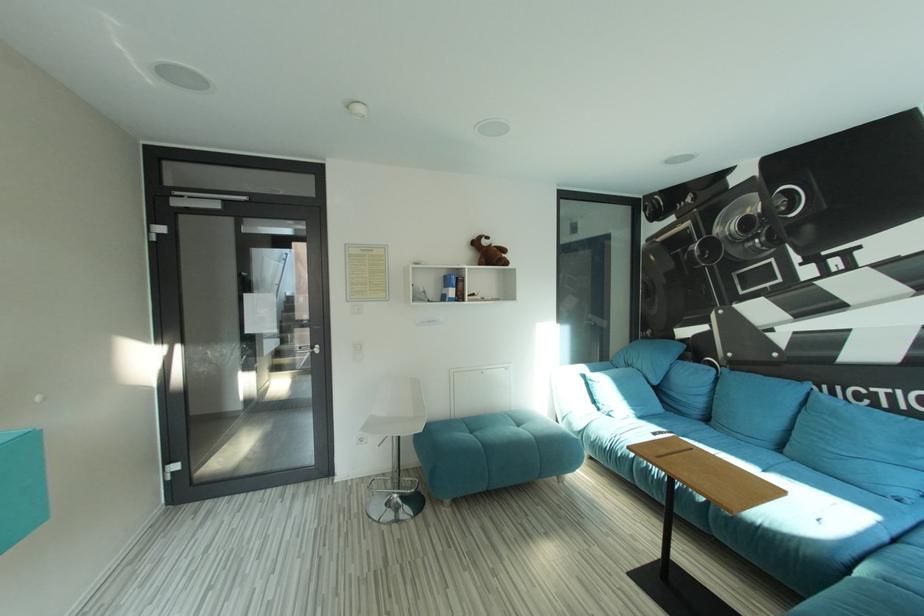
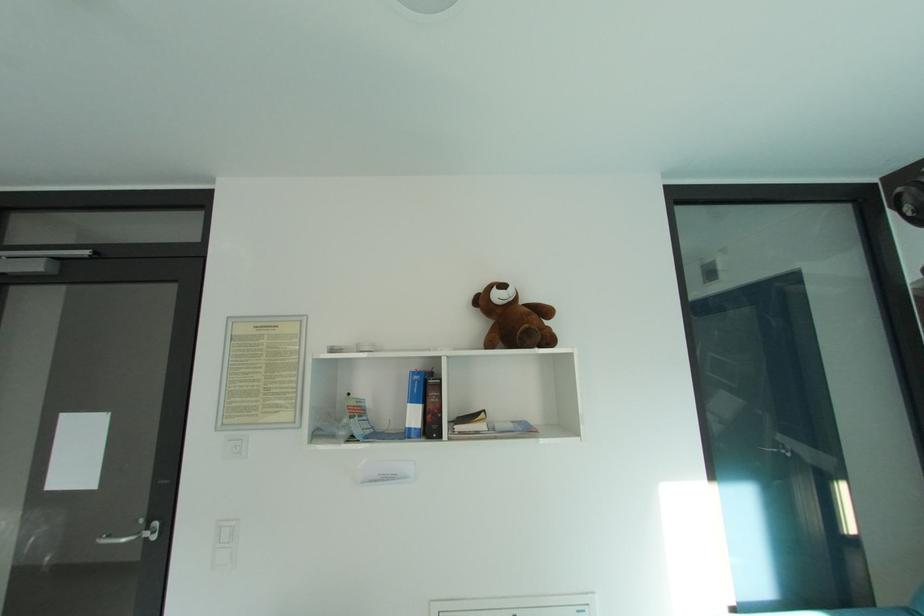
Question: Which direction would the cameraman need to move to produce the second image? Reply with the corresponding letter.

Choices:
 (A) Left
 (B) Right
 (C) Forward
 (D) Backward

Answer: (C)